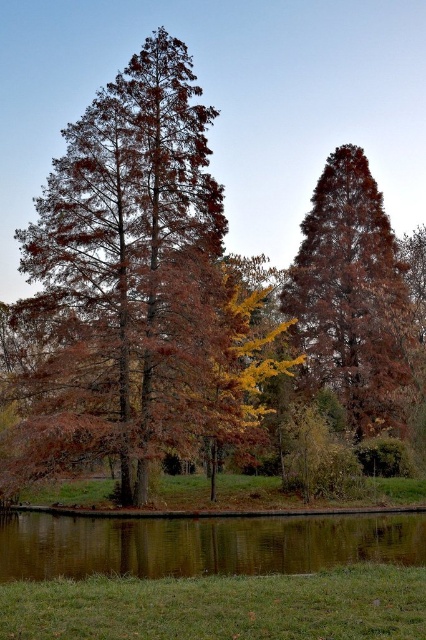
Question: Does matte brown tree at center have a smaller size compared to green reflective water at bottom?

Choices:
 (A) yes
 (B) no

Answer: (B)

Question: Is matte brown tree at center positioned at the back of green reflective water at bottom?

Choices:
 (A) no
 (B) yes

Answer: (B)

Question: Is matte brown tree at center bigger than green reflective water at bottom?

Choices:
 (A) no
 (B) yes

Answer: (B)

Question: Which point is closer to the camera?

Choices:
 (A) matte brown tree at center
 (B) green reflective water at bottom

Answer: (B)

Question: Among these objects, which one is nearest to the camera?

Choices:
 (A) matte brown tree at center
 (B) green reflective water at bottom

Answer: (B)

Question: Which of the following is the closest to the observer?

Choices:
 (A) matte brown tree at center
 (B) green reflective water at bottom

Answer: (B)